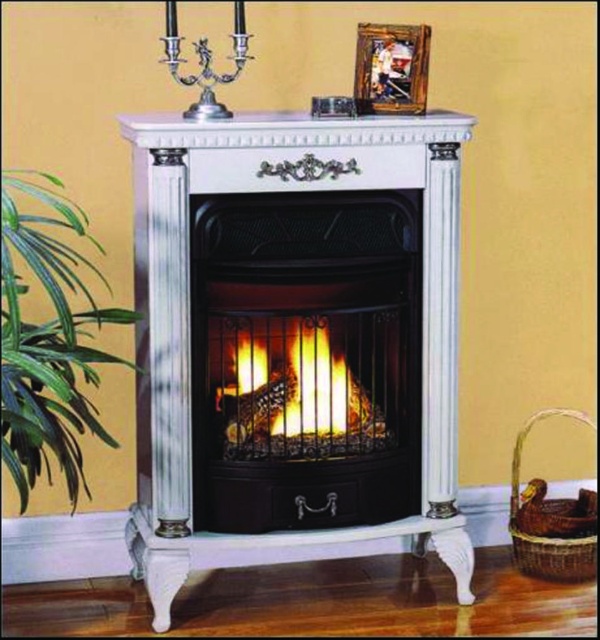
You are standing in front of the corner electric fireplace and want to place a rectangular gift box on the mantel. The gift box is slightly wider than the wooden photo frame at upper center. Is there enough space on the mantel to place the gift box next to the orange glowing wood at center without overlapping?

The orange glowing wood at center might be wider than the wooden photo frame at upper center. Since the gift box is slightly wider than the wooden photo frame at upper center, it may not fit next to the orange glowing wood at center if the orange glowing wood is indeed wider. Check the actual width to confirm.

You are arranging flowers for a party and need to place a vase between the green leafy plant at left and the silver metallic candle holder at upper center. Based on their positions, where should you place the vase?

The green leafy plant at left is positioned under the silver metallic candle holder at upper center, so placing the vase between them would require positioning it below the silver metallic candle holder at upper center and above the green leafy plant at left.